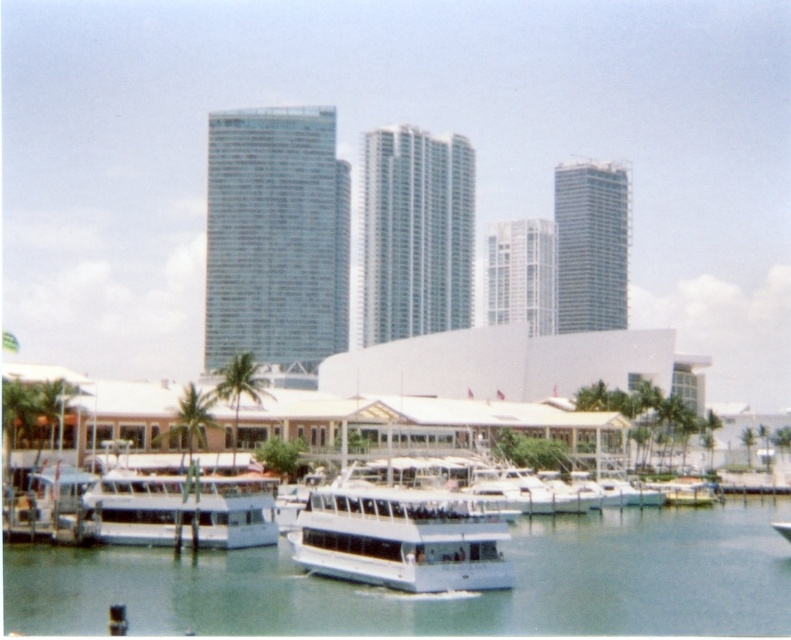
Question: Which point is farther to the camera?

Choices:
 (A) (229, 364)
 (B) (785, 595)
 (C) (199, 506)

Answer: (A)

Question: Can you confirm if white glossy boat at center is wider than green leafy palm tree at lower left?

Choices:
 (A) no
 (B) yes

Answer: (A)

Question: Is white glossy boat at lower left positioned in front of green leafy palm tree at lower left?

Choices:
 (A) yes
 (B) no

Answer: (A)

Question: Where is white glossy boat at center located in relation to white glossy boat at lower left in the image?

Choices:
 (A) below
 (B) above

Answer: (A)

Question: Which of the following is the farthest from the observer?

Choices:
 (A) white glossy boat at center
 (B) green leafy palm tree at lower left
 (C) white glossy boat at lower left
 (D) clear water at center

Answer: (B)

Question: Which point is farther to the camera?

Choices:
 (A) (229, 374)
 (B) (414, 513)

Answer: (A)